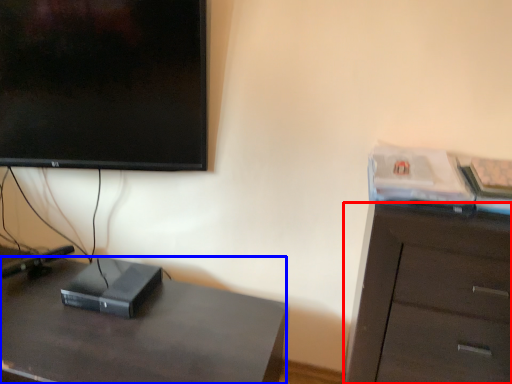
Question: Among these objects, which one is farthest to the camera, cabinetry (highlighted by a red box) or desk (highlighted by a blue box)?

Choices:
 (A) cabinetry
 (B) desk

Answer: (B)